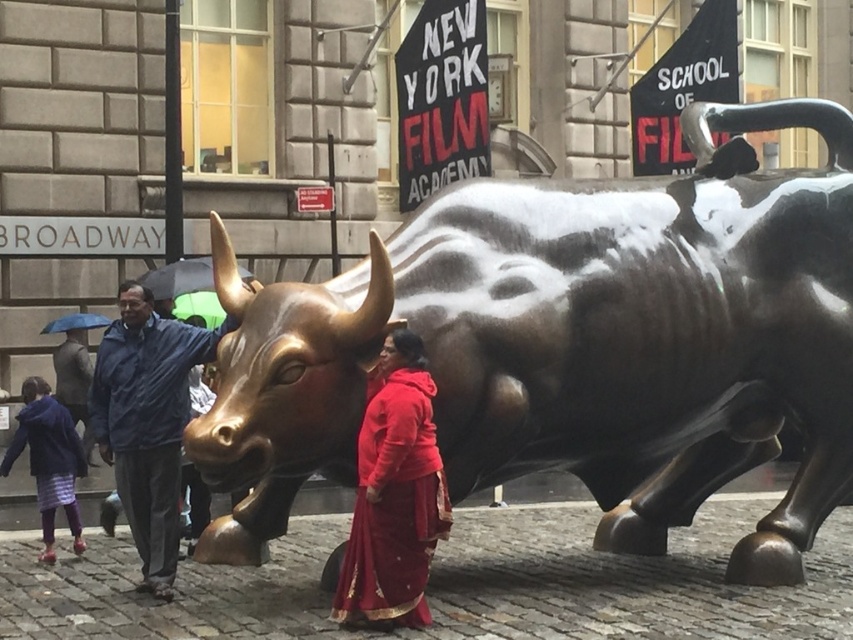
Question: Which of the following is the closest to the observer?

Choices:
 (A) (68, 440)
 (B) (181, 424)
 (C) (351, 580)

Answer: (C)

Question: Which is nearer to the plaid fabric pants at lower left?

Choices:
 (A) bronze bull at center
 (B) blue fabric jacket at center

Answer: (B)

Question: Which object is positioned farthest from the plaid fabric pants at lower left?

Choices:
 (A) blue fabric jacket at center
 (B) bronze bull at center

Answer: (B)

Question: Is red satin dress at center to the left of plaid fabric pants at lower left from the viewer's perspective?

Choices:
 (A) yes
 (B) no

Answer: (B)

Question: Does bronze bull at center appear under red satin dress at center?

Choices:
 (A) yes
 (B) no

Answer: (B)

Question: Can you confirm if red satin dress at center is positioned to the right of plaid fabric pants at lower left?

Choices:
 (A) yes
 (B) no

Answer: (A)